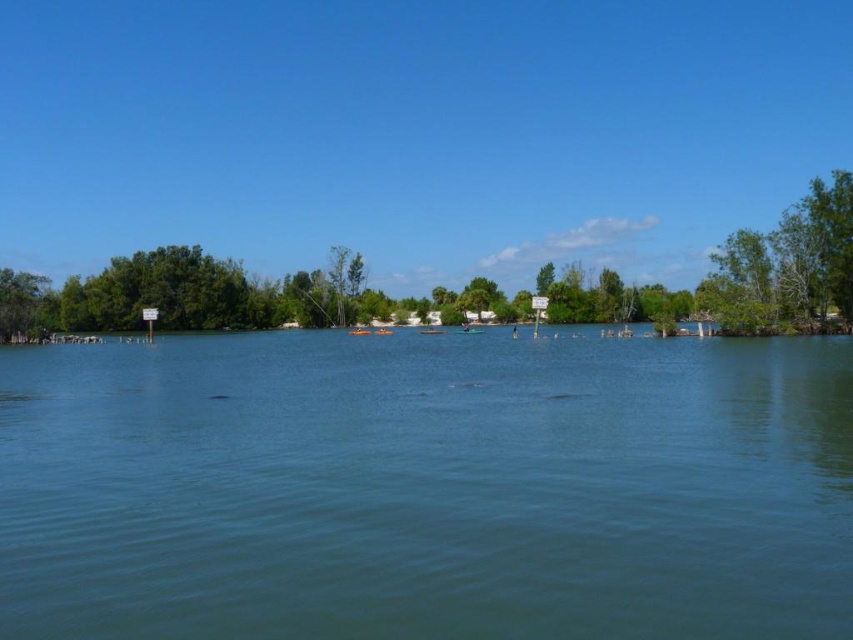
Question: In this image, where is clear blue water at center located relative to green leafy tree at left?

Choices:
 (A) right
 (B) left

Answer: (A)

Question: Which object is closer to the camera taking this photo?

Choices:
 (A) clear blue water at center
 (B) green leafy tree at left

Answer: (A)

Question: Which of the following is the closest to the observer?

Choices:
 (A) green leafy tree at left
 (B) clear blue water at center

Answer: (B)

Question: Is clear blue water at center to the left of green leafy tree at left from the viewer's perspective?

Choices:
 (A) yes
 (B) no

Answer: (B)

Question: From the image, what is the correct spatial relationship of clear blue water at center in relation to green leafy tree at left?

Choices:
 (A) above
 (B) below

Answer: (B)